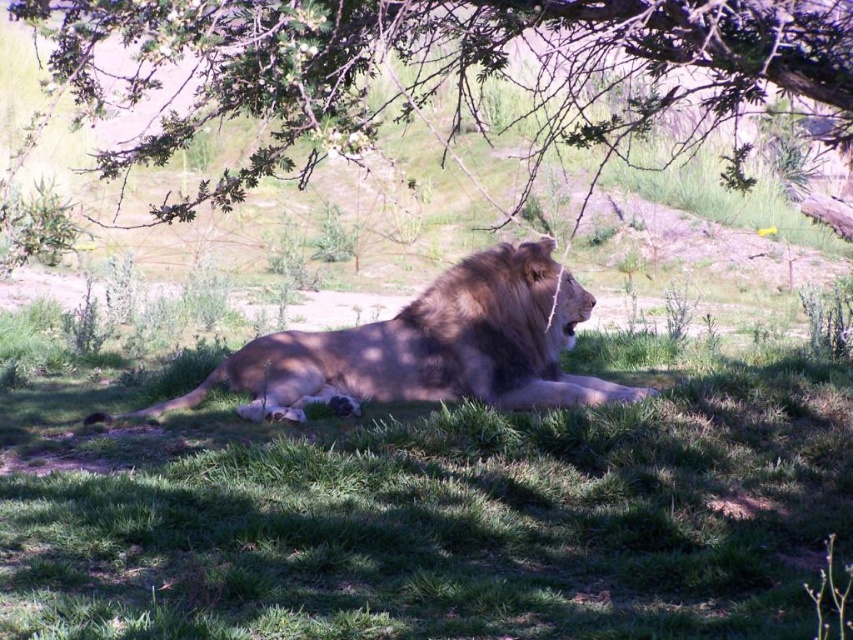
Who is lower down, green grassy at center or green leafy branches at upper center?

Positioned lower is green grassy at center.

Is point (410, 632) behind point (175, 113)?

No, (410, 632) is closer to viewer.

Identify the location of green grassy at center. (432, 516).

Does point (236, 189) come in front of point (402, 317)?

That is True.

Is green leafy branches at upper center thinner than golden brown fur lion at center?

Incorrect, green leafy branches at upper center's width is not less than golden brown fur lion at center's.

Is point (26, 20) behind point (300, 349)?

Yes, point (26, 20) is farther from viewer.

The width and height of the screenshot is (853, 640). I want to click on green leafy branches at upper center, so click(440, 68).

In the scene shown: Can you confirm if green grassy at center is positioned above golden brown fur lion at center?

No, green grassy at center is not above golden brown fur lion at center.

Is point (49, 522) behind point (254, 364)?

That is False.

Is point (335, 496) positioned in front of point (485, 369)?

Yes, point (335, 496) is in front of point (485, 369).

At what (x,y) coordinates should I click in order to perform the action: click on green grassy at center. Please return your answer as a coordinate pair (x, y). Looking at the image, I should click on (432, 516).